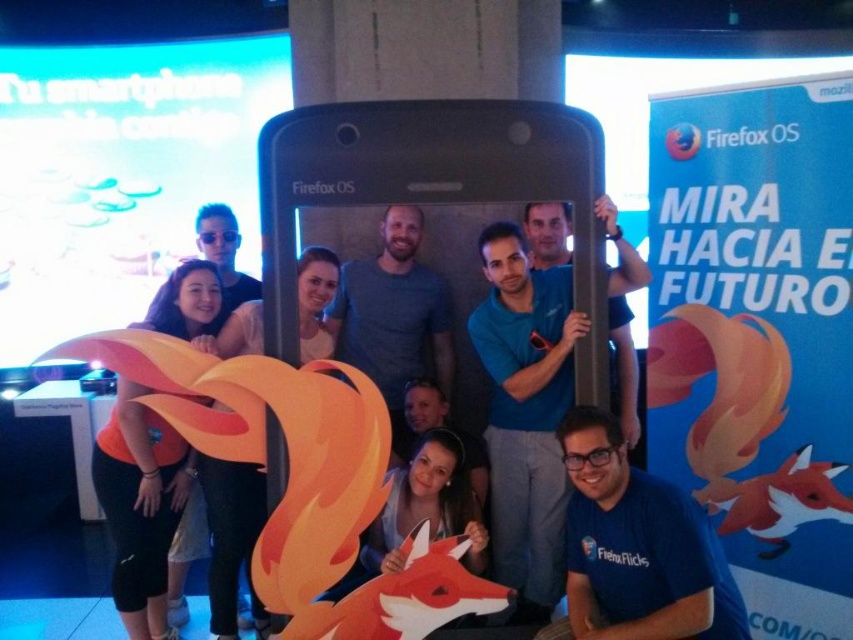
Can you confirm if matte black phone at center is positioned above blue fabric shirt at center?

Yes, matte black phone at center is above blue fabric shirt at center.

Which is behind, point (555, 228) or point (607, 476)?

The point (555, 228) is behind.

Does point (492, 321) lie in front of point (602, 536)?

That is False.

Where is `matte black phone at center`? The height and width of the screenshot is (640, 853). matte black phone at center is located at coordinates (526, 401).

Identify the location of blue fabric shirt at center. The width and height of the screenshot is (853, 640). (637, 547).

This screenshot has width=853, height=640. What do you see at coordinates (637, 547) in the screenshot?
I see `blue fabric shirt at center` at bounding box center [637, 547].

Between point (740, 602) and point (117, 468), which one is positioned behind?

The point (117, 468) is behind.

Identify the location of blue fabric shirt at center. (637, 547).

Is matte black phone at center positioned before matte orange fox at lower left?

That is True.

Does matte black phone at center have a smaller size compared to matte orange fox at lower left?

Incorrect, matte black phone at center is not smaller in size than matte orange fox at lower left.

Describe the element at coordinates (526, 401) in the screenshot. Image resolution: width=853 pixels, height=640 pixels. I see `matte black phone at center` at that location.

Locate an element on the screen. The height and width of the screenshot is (640, 853). matte black phone at center is located at coordinates (526, 401).